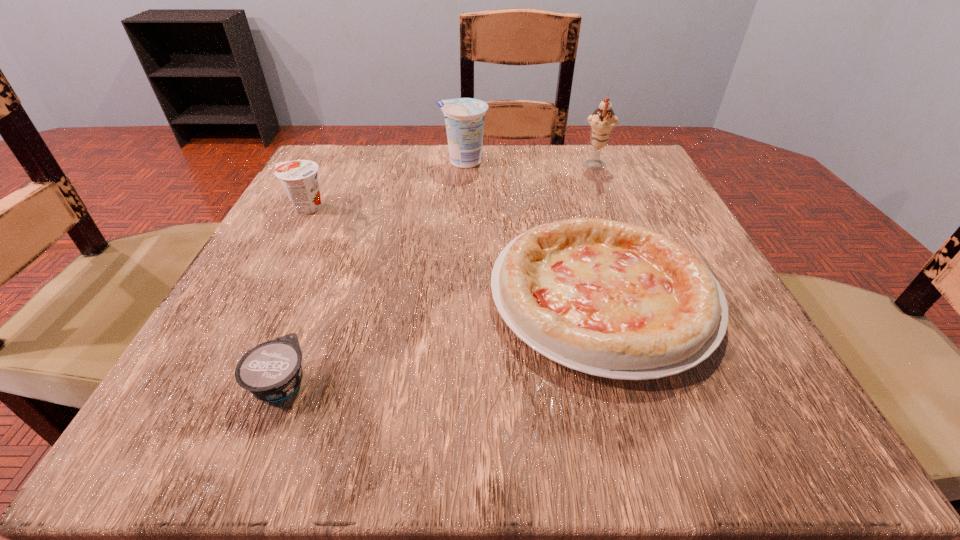
Locate which yogurt is the second closest to the icecream. Please provide its 2D coordinates. Your answer should be formatted as a tuple, i.e. [(x, y)], where the tuple contains the x and y coordinates of a point satisfying the conditions above.

[(299, 178)]

The height and width of the screenshot is (540, 960). I want to click on yogurt that stands as the second closest to the tallest object, so click(x=299, y=178).

You are a GUI agent. You are given a task and a screenshot of the screen. Output one action in this format:
    pyautogui.click(x=<x>, y=<y>)
    Task: Click on the free space in the image that satisfies the following two spatial constraints: 1. on the front side of the leftmost object; 2. on the left side of the pizza
    The width and height of the screenshot is (960, 540).
    Given the screenshot: What is the action you would take?
    tap(260, 295)